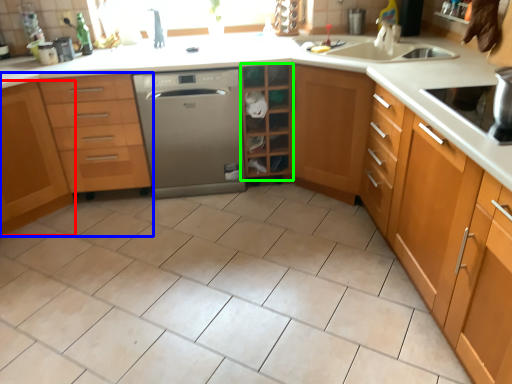
Question: Estimate the real-world distances between objects in this image. Which object is closer to cabinetry (highlighted by a red box), cabinetry (highlighted by a blue box) or shelf (highlighted by a green box)?

Choices:
 (A) cabinetry
 (B) shelf

Answer: (A)